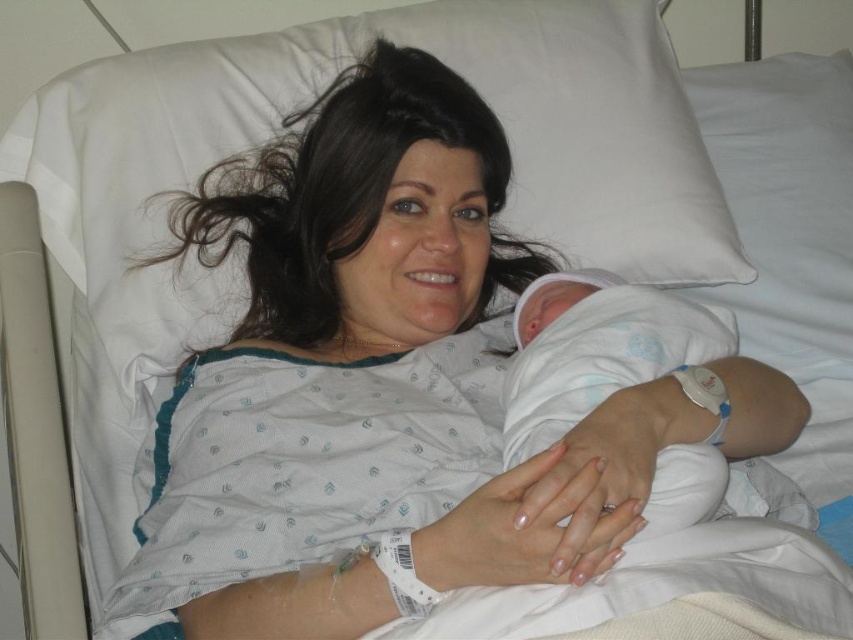
What do you see at coordinates (785, 204) in the screenshot?
I see `white fabric pillow at upper right` at bounding box center [785, 204].

Which of these two, white fabric pillow at upper right or white soft cloth at center, stands shorter?

white soft cloth at center

Locate an element on the screen. The image size is (853, 640). white fabric pillow at upper right is located at coordinates (785, 204).